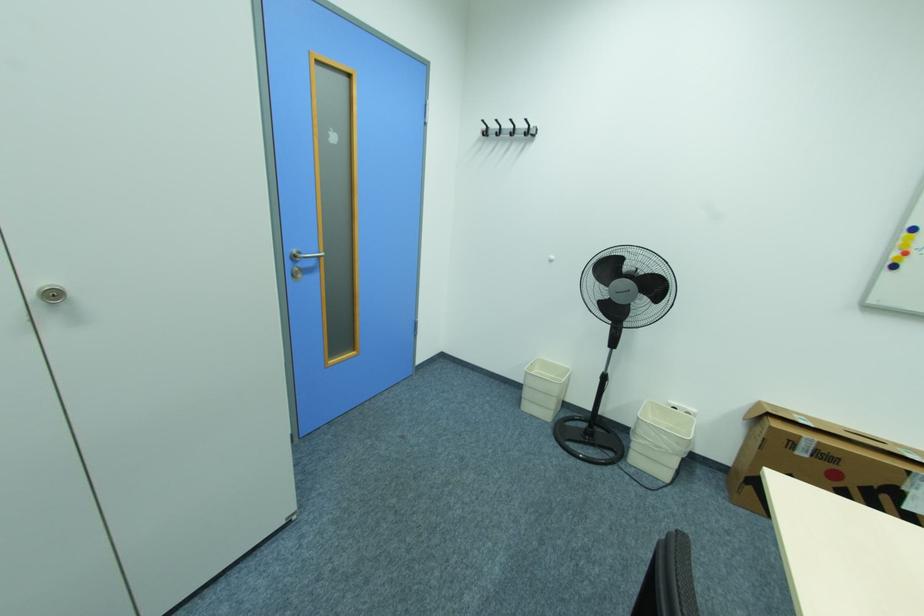
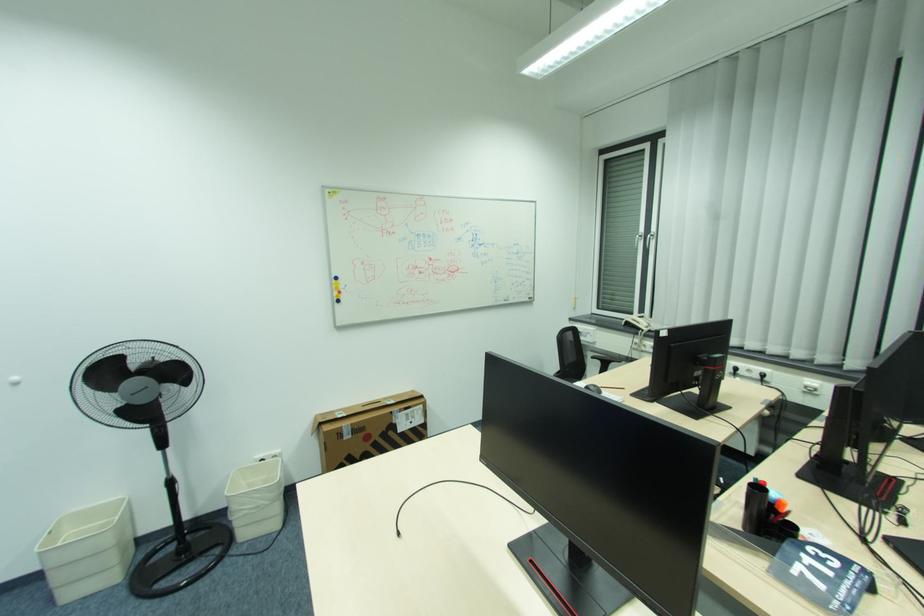
In the second image, find the point that corresponds to the point at 608,370 in the first image.

(169, 477)